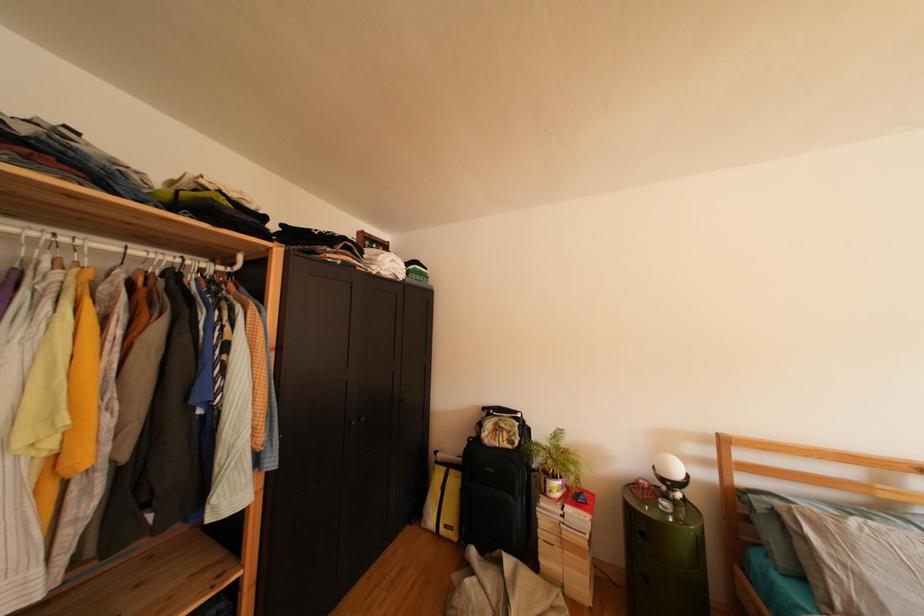
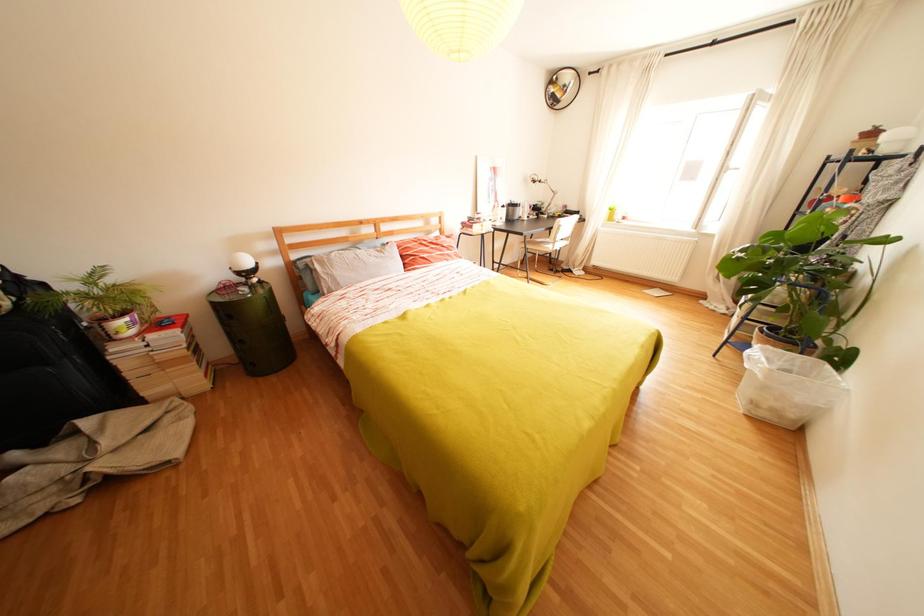
The images are taken continuously from a first-person perspective. In which direction is your viewpoint rotating?

The rotation direction of the camera is right-down.